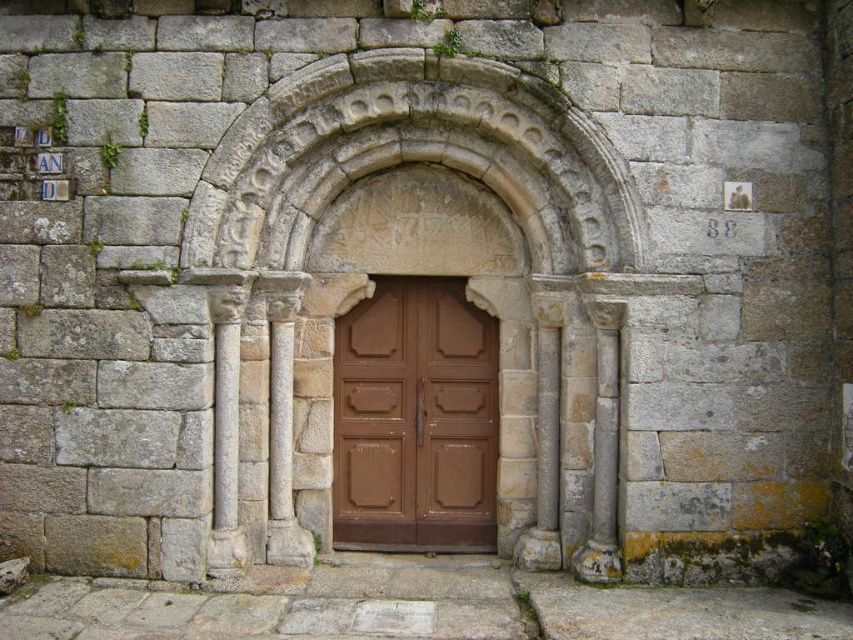
You are standing in front of a historical stone structure and notice a point marked at coordinates (410, 154). What architectural feature is located at this point?

The carved stone arch at center is located at point (410, 154).

You are an architect examining the stone structure. You need to determine which object has a greater width between the carved stone arch at center and the brown matte door at center. Which one is wider?

The carved stone arch at center is wider than the brown matte door at center according to the description.

You are standing in front of the historical stone structure and notice two points marked on the archway. Based on their positions, which point, point (302, 90) or point (334, 336), is closer to you?

Point (302, 90) is closer to you since it is in front of point (334, 336) according to their spatial arrangement.